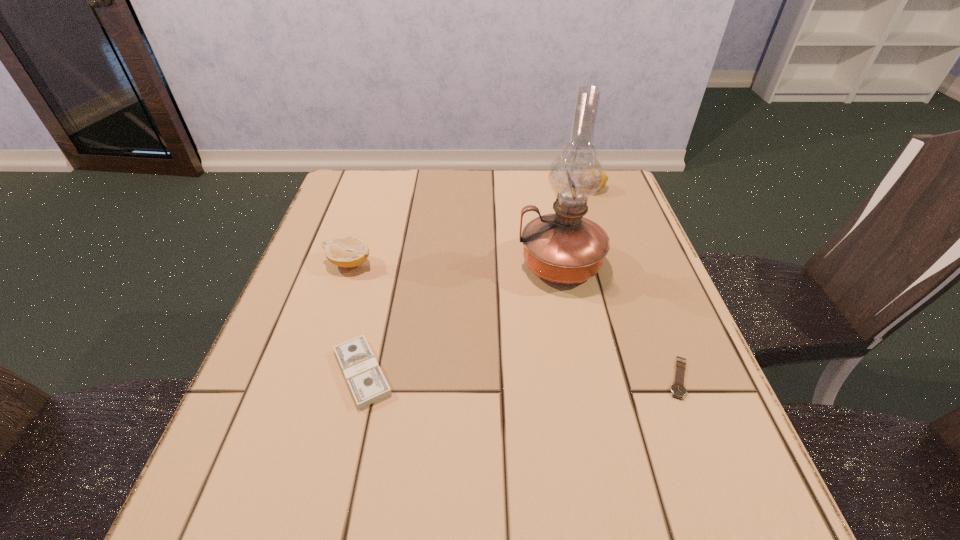
You are a GUI agent. You are given a task and a screenshot of the screen. Output one action in this format:
    pyautogui.click(x=<x>, y=<y>)
    Task: Click on the free space between the taller lemon and the shorter lemon
    
    Given the screenshot: What is the action you would take?
    coord(470,226)

Where is `the fourth closest object to the watch`? The width and height of the screenshot is (960, 540). the fourth closest object to the watch is located at coordinates (347, 251).

Choose which object is the second nearest neighbor to the tallest object. Please provide its 2D coordinates. Your answer should be formatted as a tuple, i.e. [(x, y)], where the tuple contains the x and y coordinates of a point satisfying the conditions above.

[(605, 179)]

Image resolution: width=960 pixels, height=540 pixels. Find the location of `free space that satisfies the following two spatial constraints: 1. on the back side of the dollar; 2. on the left side of the tallest object`. free space that satisfies the following two spatial constraints: 1. on the back side of the dollar; 2. on the left side of the tallest object is located at coordinates (388, 264).